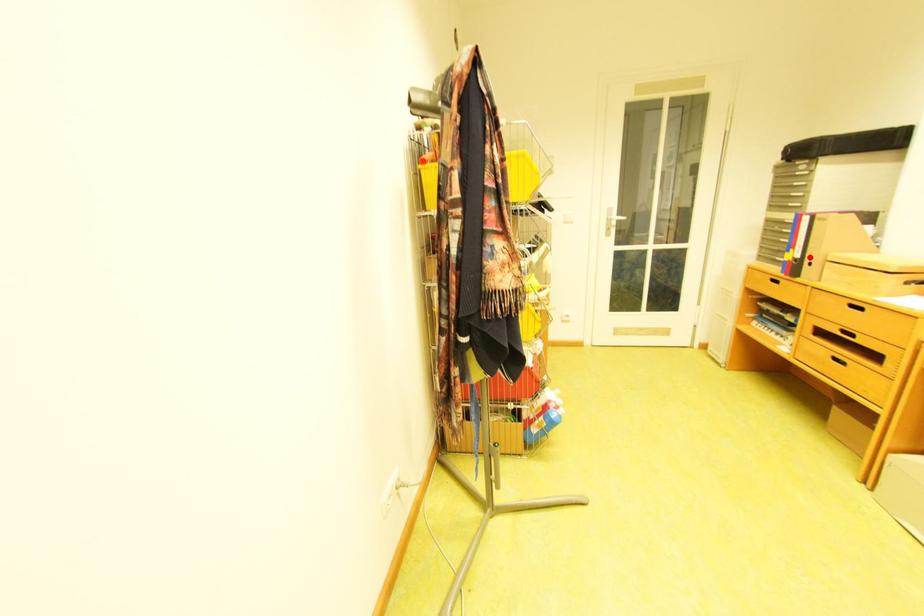
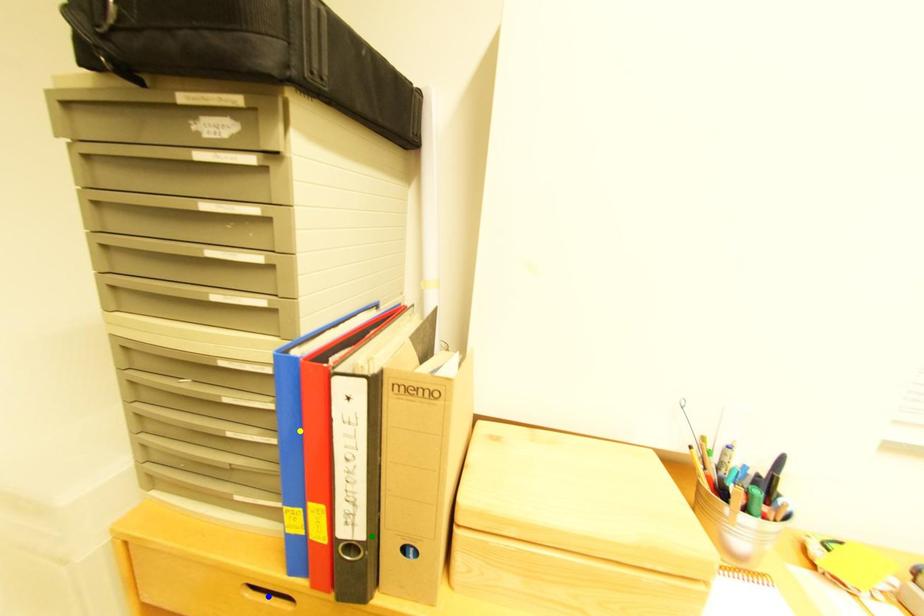
Question: I am providing you with two images of the same scene from different viewpoints. A red point is marked on the first image. You are given multiple points on the second image. Which spot in image 2 lines up with the point in image 1?

Choices:
 (A) green point
 (B) blue point
 (C) yellow point

Answer: (A)